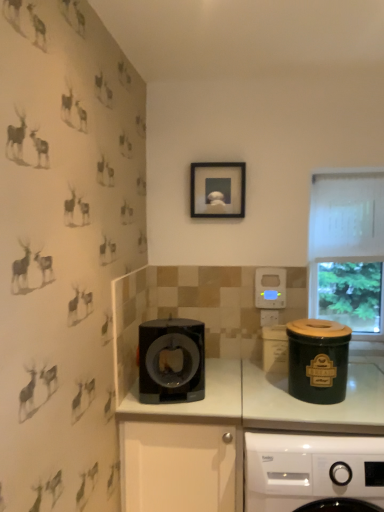
Question: Is black plastic drawer at center surrounding black matte picture frame at upper center?

Choices:
 (A) no
 (B) yes

Answer: (A)

Question: Is black plastic drawer at center positioned far away from black matte picture frame at upper center?

Choices:
 (A) no
 (B) yes

Answer: (B)

Question: Is black plastic drawer at center outside of black matte picture frame at upper center?

Choices:
 (A) yes
 (B) no

Answer: (A)

Question: Does black plastic drawer at center have a greater width compared to black matte picture frame at upper center?

Choices:
 (A) no
 (B) yes

Answer: (B)

Question: From a real-world perspective, does black plastic drawer at center stand above black matte picture frame at upper center?

Choices:
 (A) yes
 (B) no

Answer: (B)

Question: Is green ceramic canister at right inside or outside of transparent glass window at upper right?

Choices:
 (A) outside
 (B) inside

Answer: (A)

Question: Does point (284, 483) appear closer or farther from the camera than point (362, 289)?

Choices:
 (A) closer
 (B) farther

Answer: (A)

Question: Considering their positions, is green ceramic canister at right located in front of or behind transparent glass window at upper right?

Choices:
 (A) behind
 (B) front

Answer: (B)

Question: In the image, is green ceramic canister at right on the left side or the right side of transparent glass window at upper right?

Choices:
 (A) left
 (B) right

Answer: (A)

Question: Considering the relative positions of green ceramic canister at right and black glossy coffee maker at center in the image provided, is green ceramic canister at right to the left or to the right of black glossy coffee maker at center?

Choices:
 (A) left
 (B) right

Answer: (B)

Question: In terms of height, does green ceramic canister at right look taller or shorter compared to black glossy coffee maker at center?

Choices:
 (A) tall
 (B) short

Answer: (B)

Question: From a real-world perspective, is green ceramic canister at right above or below black glossy coffee maker at center?

Choices:
 (A) below
 (B) above

Answer: (A)

Question: Is green ceramic canister at right wider or thinner than black glossy coffee maker at center?

Choices:
 (A) wide
 (B) thin

Answer: (A)

Question: From their relative heights in the image, would you say black matte picture frame at upper center is taller or shorter than green ceramic canister at right?

Choices:
 (A) tall
 (B) short

Answer: (B)

Question: Considering the positions of black matte picture frame at upper center and green ceramic canister at right in the image, is black matte picture frame at upper center wider or thinner than green ceramic canister at right?

Choices:
 (A) wide
 (B) thin

Answer: (B)